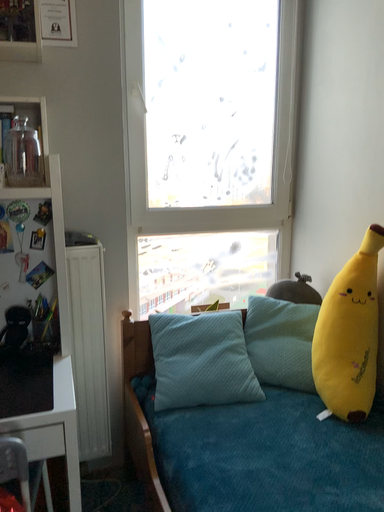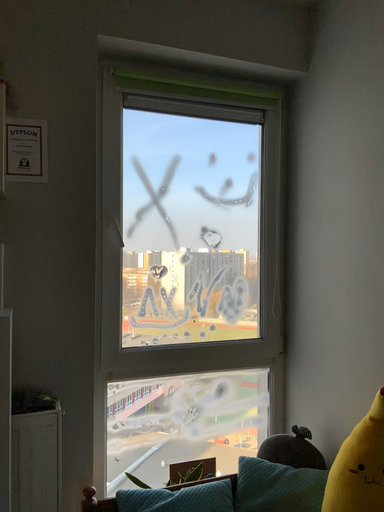
Question: How did the camera likely rotate when shooting the video?

Choices:
 (A) rotated upward
 (B) rotated downward

Answer: (A)